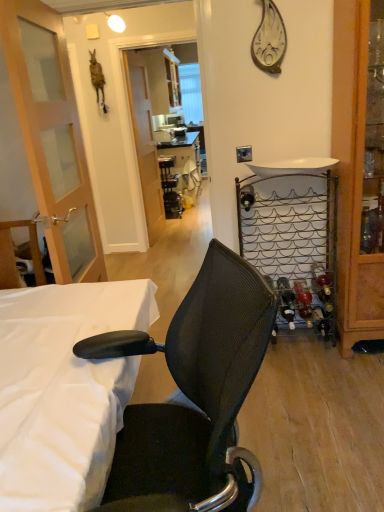
Question: From the image's perspective, is transparent glass screen door at center above white glossy sink at upper right?

Choices:
 (A) yes
 (B) no

Answer: (A)

Question: Considering the relative positions of transparent glass screen door at center and white glossy sink at upper right in the image provided, is transparent glass screen door at center to the left of white glossy sink at upper right from the viewer's perspective?

Choices:
 (A) no
 (B) yes

Answer: (B)

Question: Is transparent glass screen door at center behind white glossy sink at upper right?

Choices:
 (A) no
 (B) yes

Answer: (B)

Question: From a real-world perspective, does transparent glass screen door at center sit lower than white glossy sink at upper right?

Choices:
 (A) no
 (B) yes

Answer: (B)

Question: Is transparent glass screen door at center outside white glossy sink at upper right?

Choices:
 (A) yes
 (B) no

Answer: (A)

Question: Is transparent glass screen door at center aimed at white glossy sink at upper right?

Choices:
 (A) yes
 (B) no

Answer: (B)

Question: Is wooden cabinet at right not close to white fabric bed at lower left, which is the second bed in right-to-left order?

Choices:
 (A) no
 (B) yes

Answer: (B)

Question: Considering the relative sizes of wooden cabinet at right and white fabric bed at lower left, which is the second bed in right-to-left order, in the image provided, is wooden cabinet at right smaller than white fabric bed at lower left, which is the second bed in right-to-left order,?

Choices:
 (A) no
 (B) yes

Answer: (B)

Question: Is wooden cabinet at right at the right side of white fabric bed at lower left, the 1th bed viewed from the left?

Choices:
 (A) yes
 (B) no

Answer: (A)

Question: Does wooden cabinet at right have a larger size compared to white fabric bed at lower left, placed as the 2th bed when sorted from back to front?

Choices:
 (A) yes
 (B) no

Answer: (B)

Question: Is wooden cabinet at right aimed at white fabric bed at lower left, the 1th bed when ordered from front to back?

Choices:
 (A) yes
 (B) no

Answer: (B)

Question: Is the depth of wooden cabinet at right less than that of white fabric bed at lower left, placed as the 2th bed when sorted from back to front?

Choices:
 (A) yes
 (B) no

Answer: (B)

Question: Is white fabric bed at lower left, the 1th bed when ordered from front to back, thinner than white glossy sink at upper right?

Choices:
 (A) no
 (B) yes

Answer: (A)